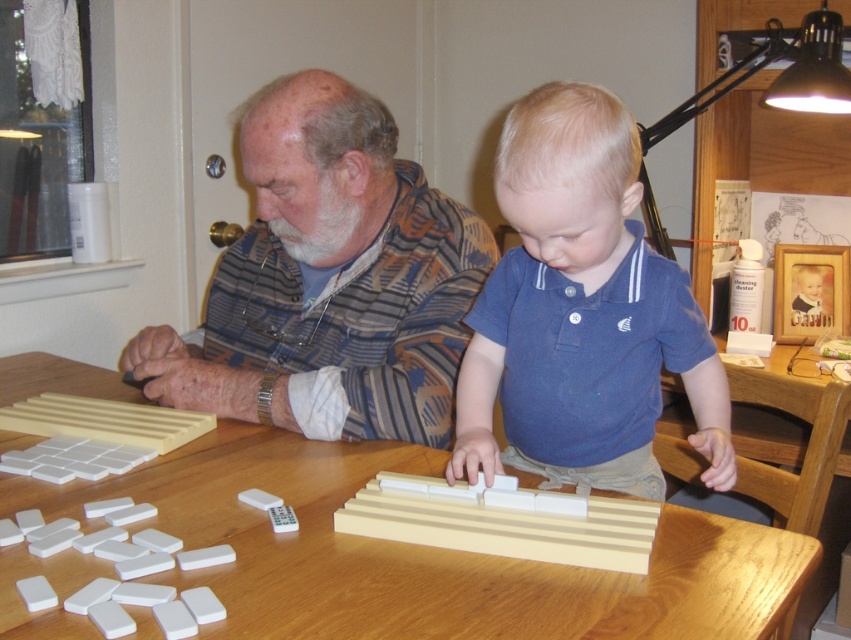
Which is in front, point (689, 589) or point (293, 192)?

Point (689, 589) is in front.

The image size is (851, 640). In order to click on wooden table at center in this screenshot , I will do `click(424, 556)`.

Is point (672, 560) positioned behind point (283, 243)?

No.

The height and width of the screenshot is (640, 851). In order to click on wooden table at center in this screenshot , I will do `click(424, 556)`.

Which is in front, point (746, 524) or point (567, 173)?

Point (567, 173) is more forward.

Does point (769, 541) come in front of point (545, 472)?

Yes, point (769, 541) is in front of point (545, 472).

The width and height of the screenshot is (851, 640). In order to click on wooden table at center in this screenshot , I will do `click(424, 556)`.

Can you confirm if striped fabric shirt at center is wider than blue cotton shirt at center?

Yes, striped fabric shirt at center is wider than blue cotton shirt at center.

Between point (346, 268) and point (689, 312), which one is positioned behind?

The point (346, 268) is more distant.

Where is `striped fabric shirt at center`? The image size is (851, 640). striped fabric shirt at center is located at coordinates (329, 282).